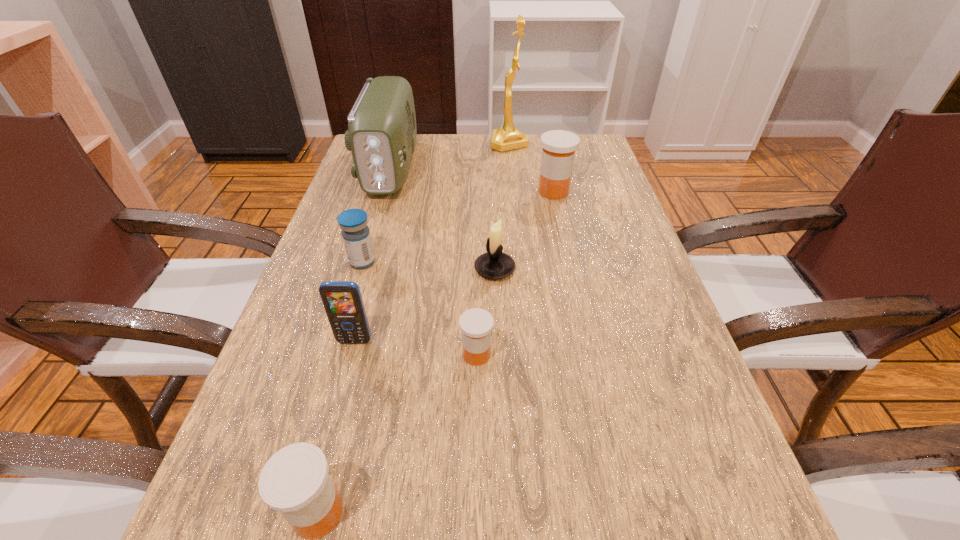
Where is `award`? award is located at coordinates (507, 137).

At what (x,y) coordinates should I click in order to perform the action: click on golden award. Please return your answer as a coordinate pair (x, y). The image size is (960, 540). Looking at the image, I should click on (507, 137).

The image size is (960, 540). I want to click on radio_receiver, so click(x=381, y=135).

In order to click on the farthest medicine in this screenshot , I will do `click(558, 146)`.

At what (x,y) coordinates should I click in order to perform the action: click on the farthest orange medicine. Please return your answer as a coordinate pair (x, y). This screenshot has width=960, height=540. Looking at the image, I should click on (558, 146).

The height and width of the screenshot is (540, 960). I want to click on cellular telephone, so click(342, 300).

Identify the location of candle holder. (494, 264).

Where is `blue medicine`? Image resolution: width=960 pixels, height=540 pixels. blue medicine is located at coordinates [x=355, y=232].

Find the location of a particular element. The width and height of the screenshot is (960, 540). the smallest orange medicine is located at coordinates (476, 324).

You are a GUI agent. You are given a task and a screenshot of the screen. Output one action in this format:
    pyautogui.click(x=<x>, y=<y>)
    Task: Click on the shortest object
    This screenshot has height=540, width=960.
    Given the screenshot: What is the action you would take?
    pyautogui.click(x=476, y=324)